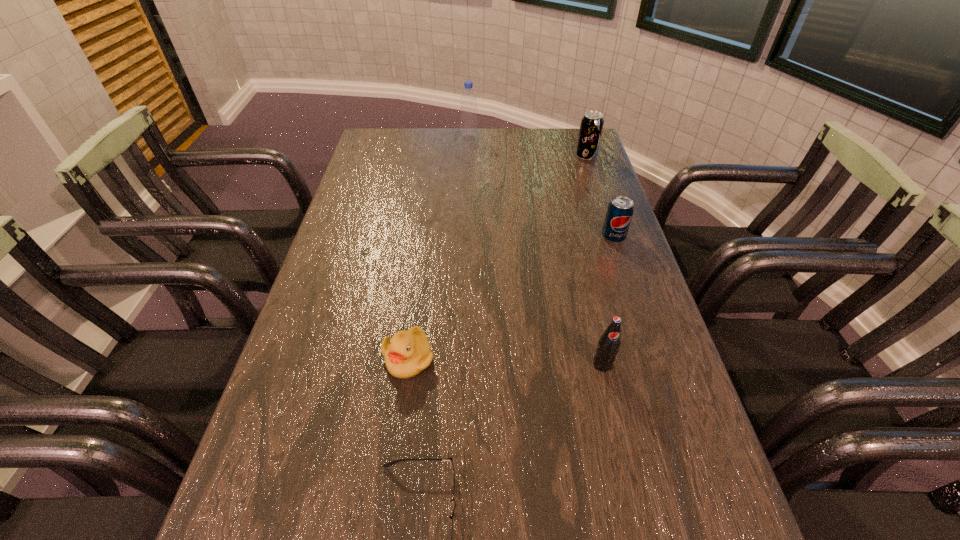
This screenshot has width=960, height=540. Find the location of `unoccupied position between the third object from right to left and the farthest soda can`. unoccupied position between the third object from right to left and the farthest soda can is located at coordinates (594, 261).

Where is `free space between the bottle and the second nearest soda can`? The image size is (960, 540). free space between the bottle and the second nearest soda can is located at coordinates (541, 187).

Where is `free spot between the shortest soda can and the leftmost soda can`? free spot between the shortest soda can and the leftmost soda can is located at coordinates (608, 301).

This screenshot has height=540, width=960. I want to click on empty space that is in between the duckling and the second farthest object, so click(497, 258).

Find the location of a particular element. This screenshot has width=960, height=540. empty space between the fourth object from left to right and the fifth tallest object is located at coordinates (506, 361).

The image size is (960, 540). What are the coordinates of `vacant area that lies between the farthest object and the second farthest soda can` in the screenshot? It's located at (541, 187).

Find the location of `object that stands as the third closest to the fifth tallest object`. object that stands as the third closest to the fifth tallest object is located at coordinates (620, 210).

Select which object appears as the fourth closest to the farthest object. Please provide its 2D coordinates. Your answer should be formatted as a tuple, i.e. [(x, y)], where the tuple contains the x and y coordinates of a point satisfying the conditions above.

[(609, 343)]

This screenshot has height=540, width=960. I want to click on soda can that stands as the third closest to the duckling, so click(x=591, y=126).

Identify which soda can is located as the second nearest to the duckling. Please provide its 2D coordinates. Your answer should be formatted as a tuple, i.e. [(x, y)], where the tuple contains the x and y coordinates of a point satisfying the conditions above.

[(620, 210)]